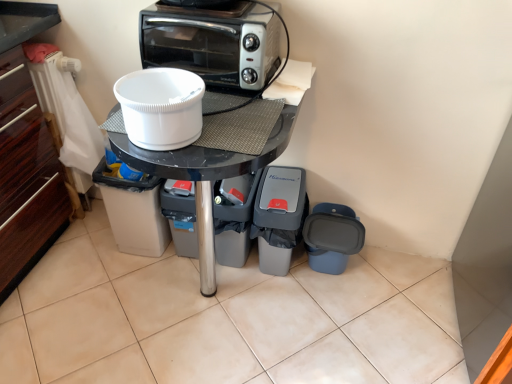
Locate an element on the screen. vacant space that is in between black glossy table at center and white plastic bucket at center, the first appliance in the left-to-right sequence is located at coordinates (126, 282).